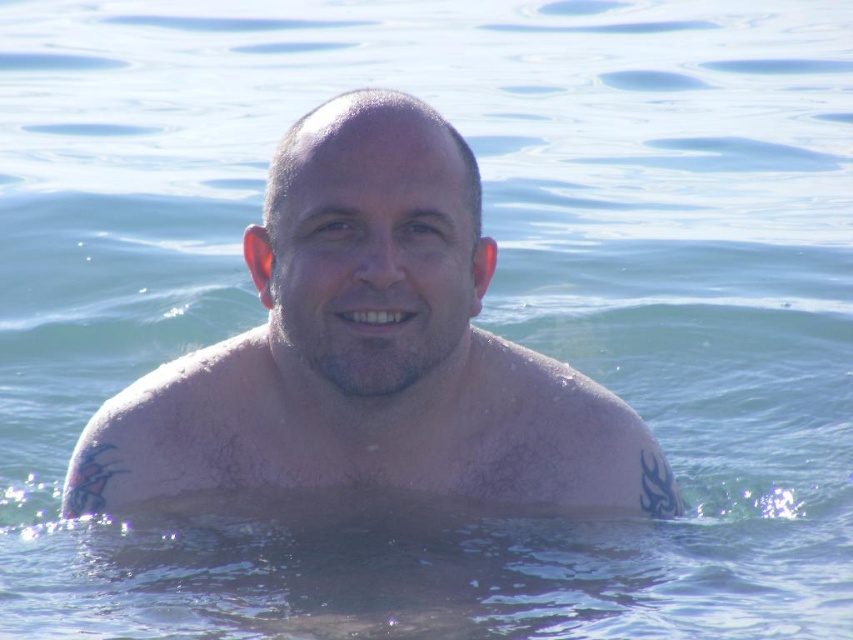
Question: Is pale skin at center thinner than pale skin muscle at center?

Choices:
 (A) no
 (B) yes

Answer: (A)

Question: Which of the following is the farthest from the observer?

Choices:
 (A) (561, 456)
 (B) (347, 262)

Answer: (A)

Question: Is pale skin at center further to the viewer compared to pale skin muscle at center?

Choices:
 (A) no
 (B) yes

Answer: (A)

Question: Is the position of pale skin at center less distant than that of pale skin muscle at center?

Choices:
 (A) no
 (B) yes

Answer: (B)

Question: Which of the following is the closest to the observer?

Choices:
 (A) (433, 410)
 (B) (238, 461)

Answer: (B)